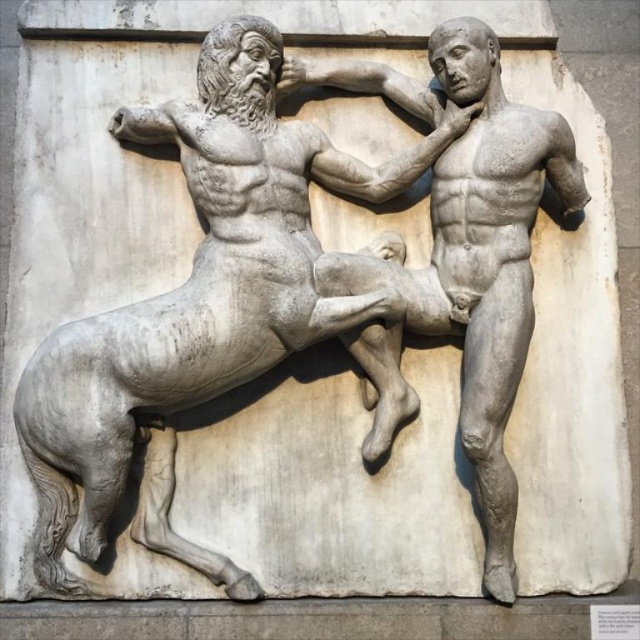
Based on the scene described, which object is shorter between the white marble horse at center and the smooth stone man at center?

The white marble horse at center is not as tall as the smooth stone man at center, so the white marble horse at center is shorter.

Looking at this image, you are an art conservator examining the classical relief sculpture. You must determine if the white marble horse at center can be safely moved without affecting the smooth stone man at center. Given their sizes, what should you consider?

The white marble horse at center is larger than the smooth stone man at center, so you should ensure that moving the horse won not cause unintended pressure or displacement on the smaller man figure.

Based on the classical relief sculpture scene, how does the size of the white marble horse at center compare to the smooth stone man at center?

The white marble horse at center is wider than the smooth stone man at center according to the description.